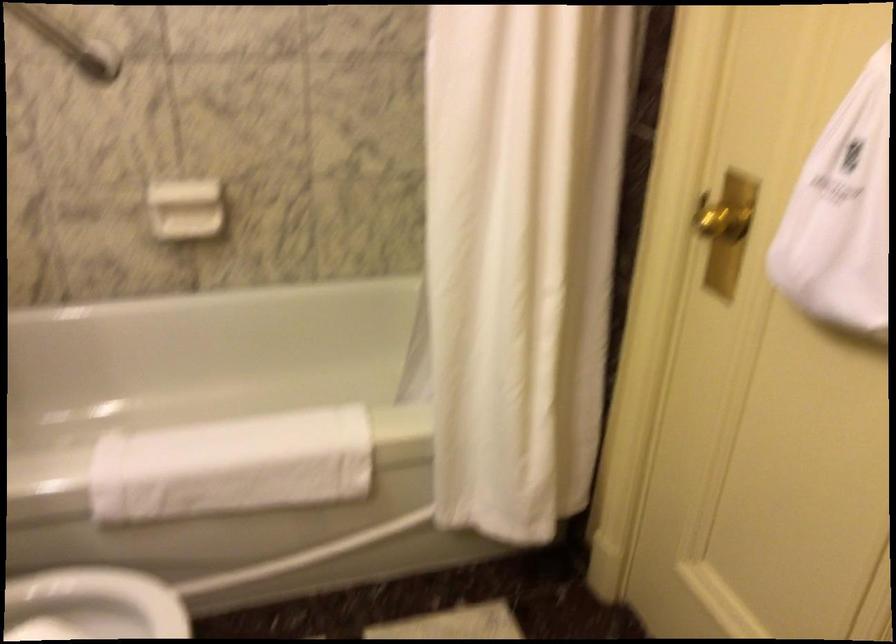
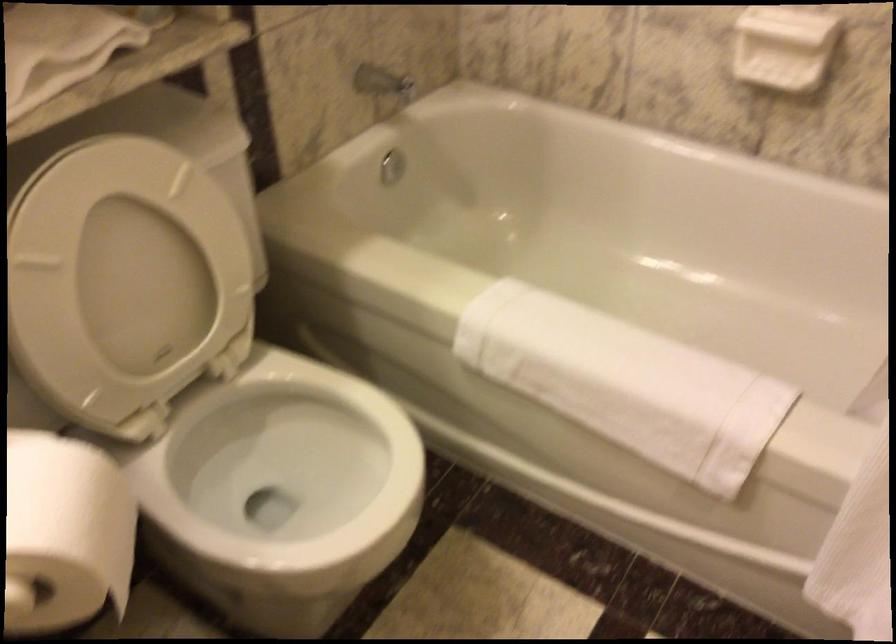
Where in the second image is the point corresponding to point (260, 459) from the first image?

(625, 383)